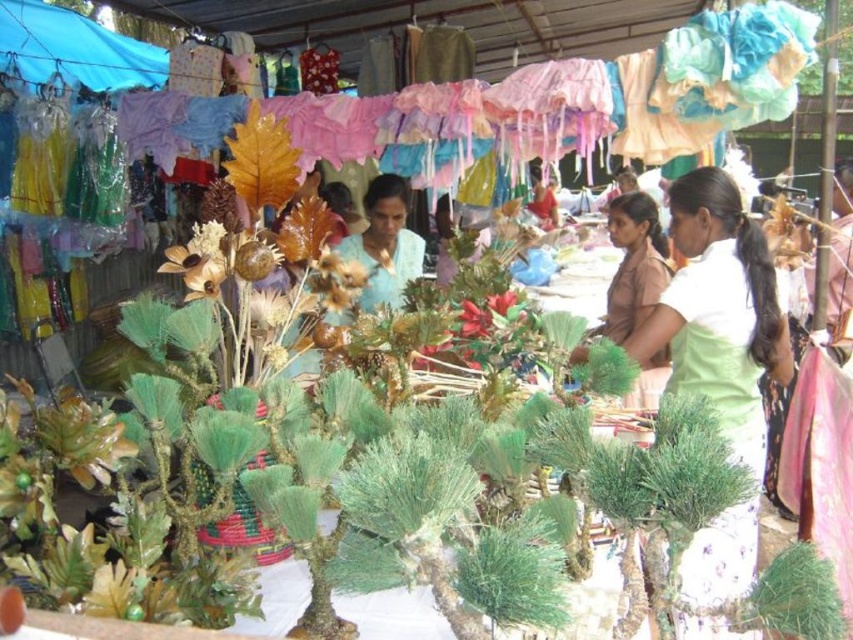
Question: Which object appears closest to the camera in this image?

Choices:
 (A) blue fabric canopy at upper left
 (B) green satin blouse at right

Answer: (B)

Question: Can you confirm if green satin blouse at right is positioned to the left of green matte plant at center?

Choices:
 (A) no
 (B) yes

Answer: (A)

Question: Is blue fabric canopy at upper left below brown matte dress at center?

Choices:
 (A) no
 (B) yes

Answer: (A)

Question: Which of the following is the farthest from the observer?

Choices:
 (A) green matte plant at center
 (B) brown matte dress at center

Answer: (B)

Question: Estimate the real-world distances between objects in this image. Which object is closer to the blue fabric canopy at upper left?

Choices:
 (A) green satin blouse at right
 (B) green matte plant at center

Answer: (A)

Question: Is blue fabric canopy at upper left positioned before brown matte dress at center?

Choices:
 (A) no
 (B) yes

Answer: (A)